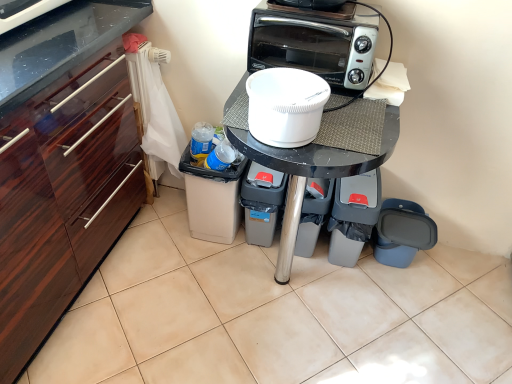
Find the location of a particular element. vacant region under blue plastic trash can at lower right, which appears as the fourth appliance when viewed from the left (from a real-world perspective) is located at coordinates (397, 271).